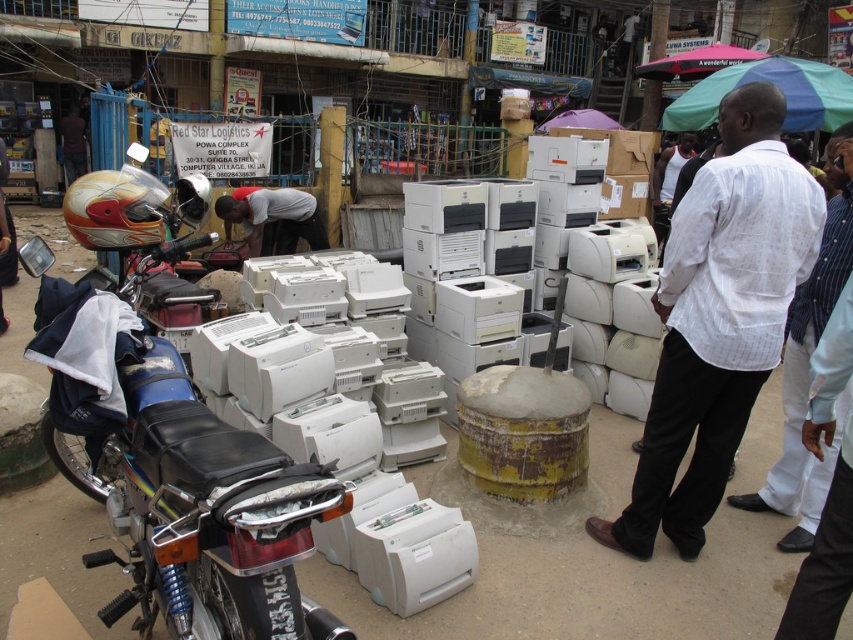
Does white striped shirt at center have a lesser height compared to dark gray fabric shirt at center?

No.

Is point (849, 173) positioned before point (287, 211)?

Yes, point (849, 173) is closer to viewer.

Is point (801, 472) in front of point (241, 193)?

Yes, it is in front of point (241, 193).

I want to click on white striped shirt at center, so click(808, 364).

Does white cotton shirt at center appear on the left side of white striped shirt at center?

Yes, white cotton shirt at center is to the left of white striped shirt at center.

Can you confirm if white cotton shirt at center is positioned above white striped shirt at center?

Indeed, white cotton shirt at center is positioned over white striped shirt at center.

This screenshot has width=853, height=640. I want to click on white cotton shirt at center, so click(x=718, y=317).

Can you confirm if shiny chrome motorcycle at left is thinner than white cotton shirt at center?

No.

Describe the element at coordinates (172, 436) in the screenshot. This screenshot has width=853, height=640. I see `shiny chrome motorcycle at left` at that location.

Is point (184, 406) positioned behind point (769, 252)?

No, (184, 406) is closer to viewer.

What are the coordinates of `shiny chrome motorcycle at left` in the screenshot? It's located at (172, 436).